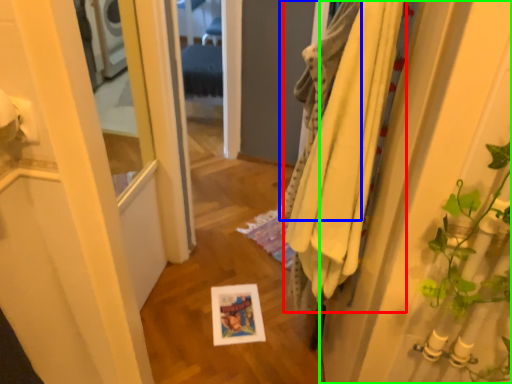
Question: Which is farther away from bath towel (highlighted by a red box)? bath towel (highlighted by a blue box) or door (highlighted by a green box)?

Choices:
 (A) bath towel
 (B) door

Answer: (B)